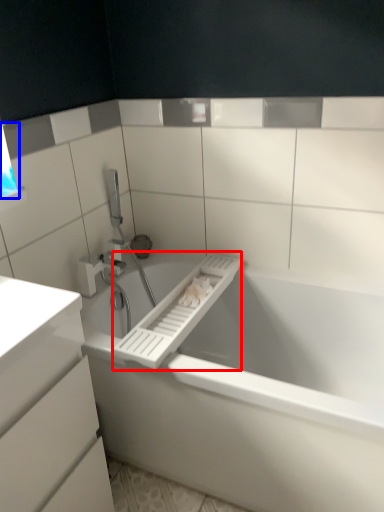
Question: Which point is closer to the camera, towel bar (highlighted by a red box) or window (highlighted by a blue box)?

Choices:
 (A) towel bar
 (B) window

Answer: (A)